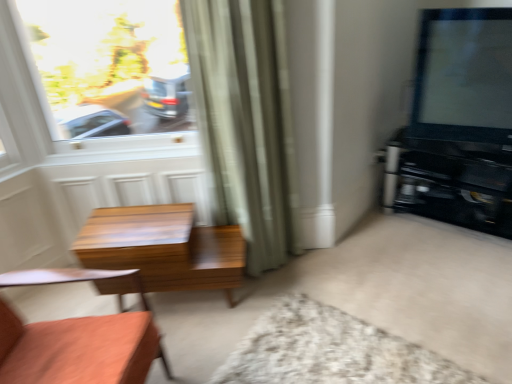
Question: In terms of height, does matte black tv at upper right look taller or shorter compared to white shaggy rug at lower center?

Choices:
 (A) short
 (B) tall

Answer: (B)

Question: Is matte black tv at upper right spatially inside white shaggy rug at lower center, or outside of it?

Choices:
 (A) inside
 (B) outside

Answer: (B)

Question: Considering the real-world distances, which object is farthest from the wooden table at center?

Choices:
 (A) green fabric curtain at center
 (B) white shaggy rug at lower center
 (C) black glossy entertainment center at right
 (D) wooden chair at lower left
 (E) clear glass window at upper left

Answer: (C)

Question: Which object is positioned farthest from the green fabric curtain at center?

Choices:
 (A) wooden table at center
 (B) matte black tv at upper right
 (C) clear glass window at upper left
 (D) wooden chair at lower left
 (E) white shaggy rug at lower center

Answer: (C)